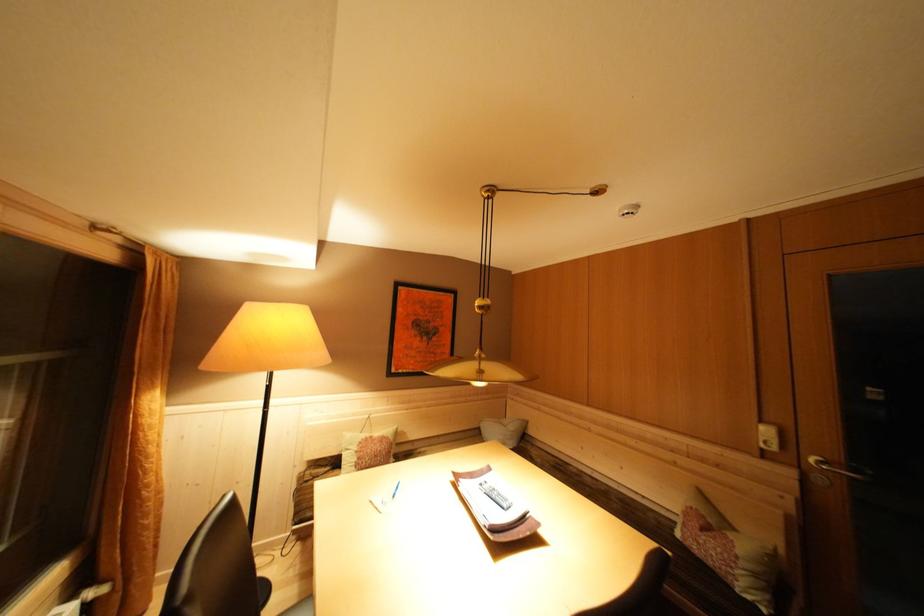
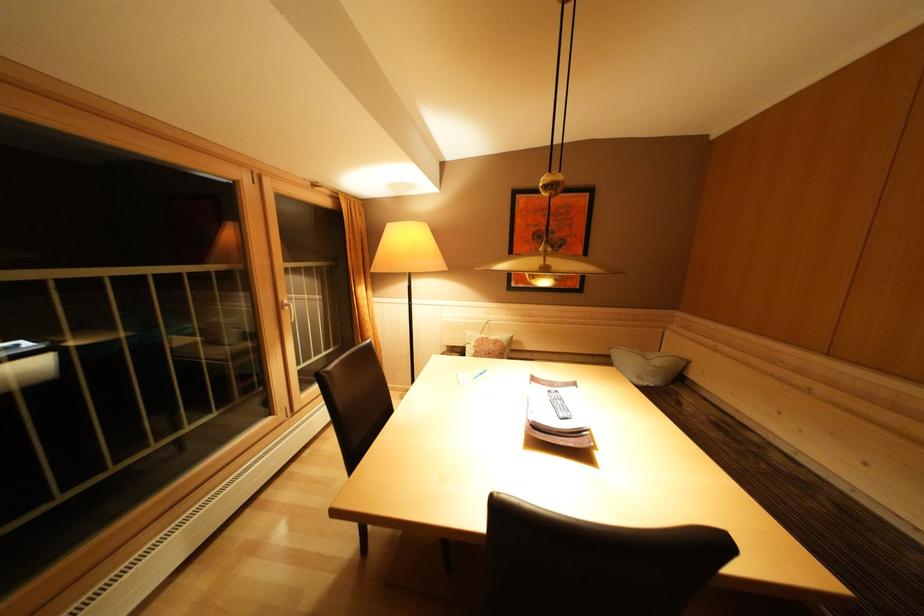
Question: How did the camera likely rotate?

Choices:
 (A) Left
 (B) Right
 (C) Up
 (D) Down

Answer: (A)